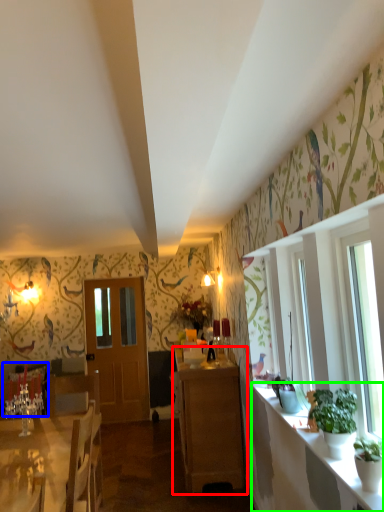
Question: Which object is positioned closest to cabinetry (highlighted by a red box)? Select from armchair (highlighted by a blue box) and counter top (highlighted by a green box).

Choices:
 (A) armchair
 (B) counter top

Answer: (B)